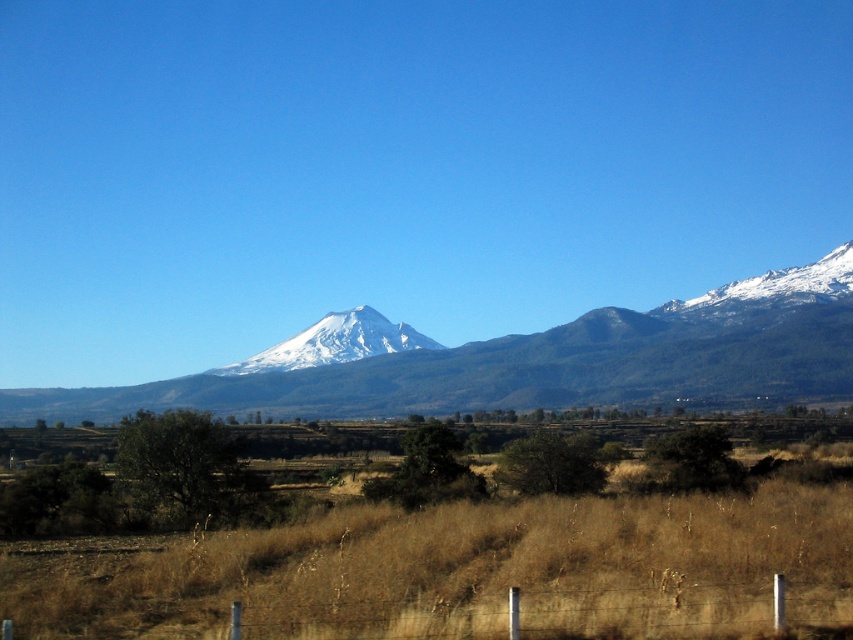
You are standing at the origin point of the image coordinate system, which is the bottom left corner. You want to place a red flag at the location of the brown dry grass at lower center. What are the coordinates where you should place the flag?

The coordinates for the brown dry grass at lower center are at point (465, 572), so you should place the red flag at those coordinates.

You are standing at the base of the snow capped mountain in the background and see the point (465, 572). What is the object located at that point?

The point (465, 572) corresponds to the brown dry grass at lower center.